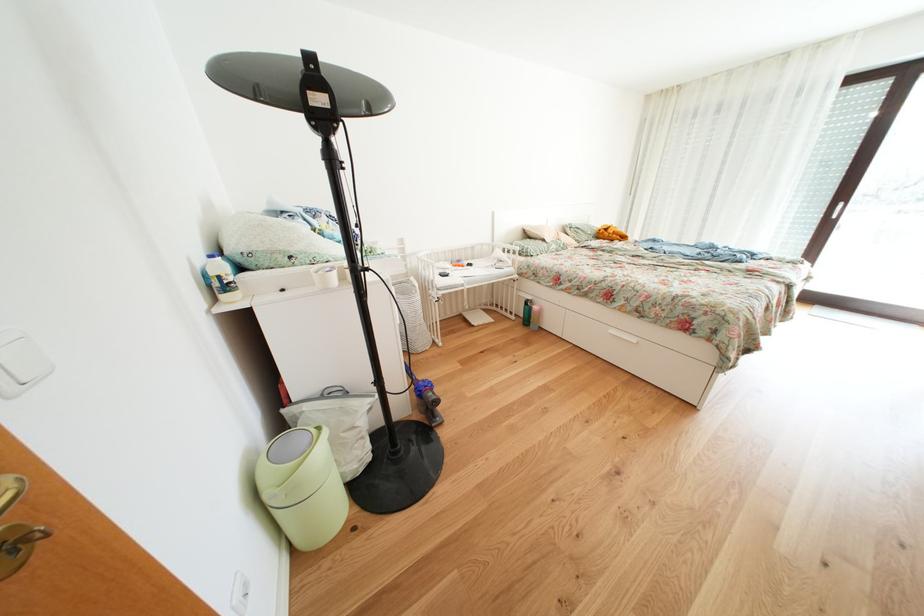
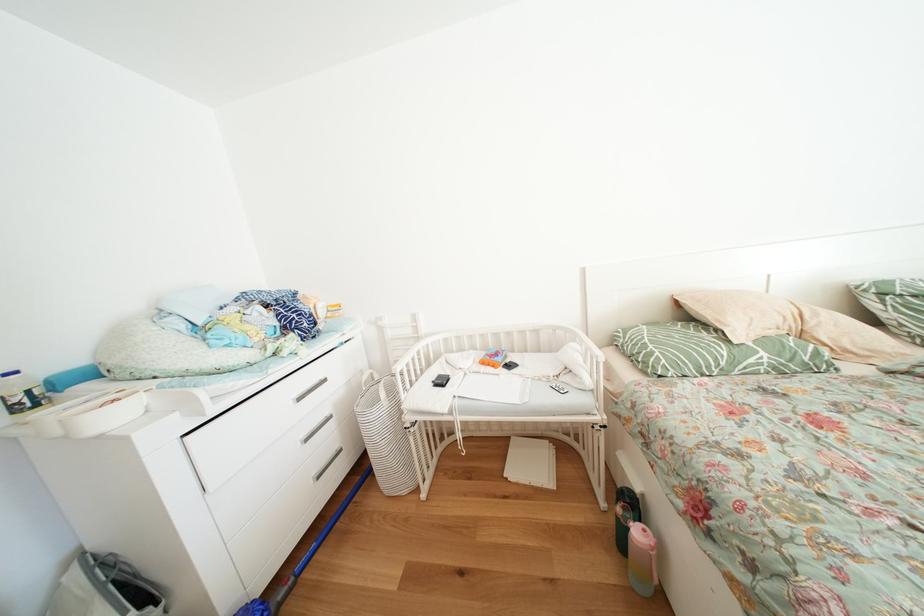
The point at (544, 313) is marked in the first image. Where is the corresponding point in the second image?

(648, 538)